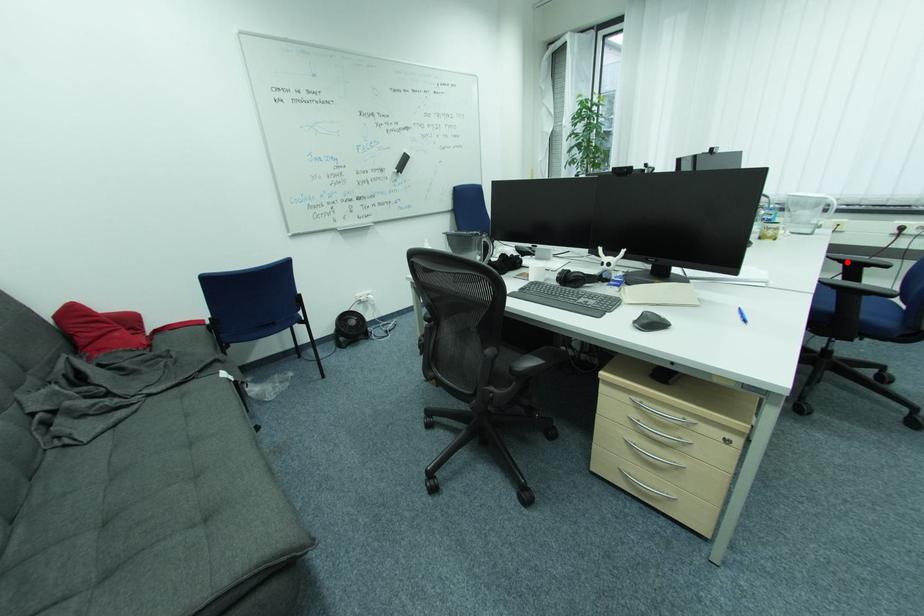
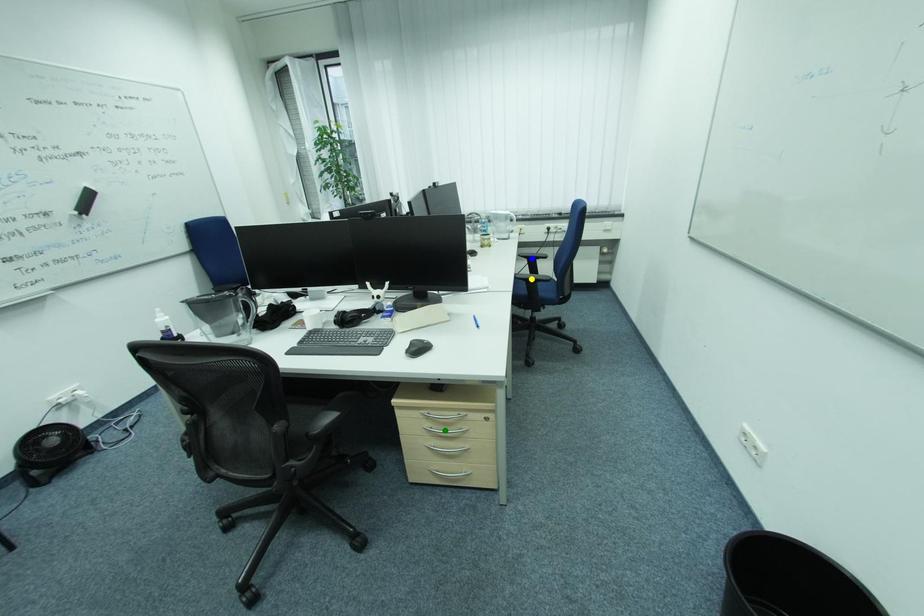
Question: I am providing you with two images of the same scene from different viewpoints. A red point is marked on the first image. You are given multiple points on the second image. Can you choose the point in image 2 that corresponds to the point in image 1?

Choices:
 (A) blue point
 (B) green point
 (C) yellow point

Answer: (A)